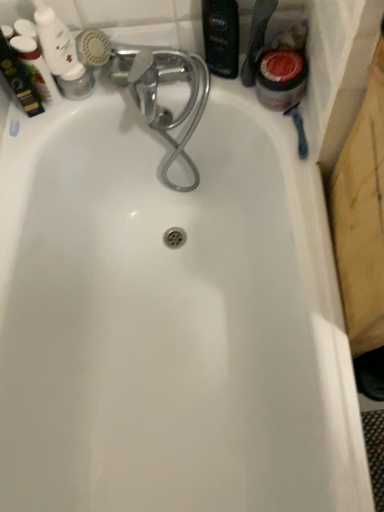
This screenshot has height=512, width=384. What do you see at coordinates (221, 37) in the screenshot?
I see `black glass wine bottle at upper right` at bounding box center [221, 37].

Identify the location of black glass wine bottle at upper right. Image resolution: width=384 pixels, height=512 pixels. (221, 37).

Image resolution: width=384 pixels, height=512 pixels. Find the location of `black glass wine bottle at upper right`. black glass wine bottle at upper right is located at coordinates (221, 37).